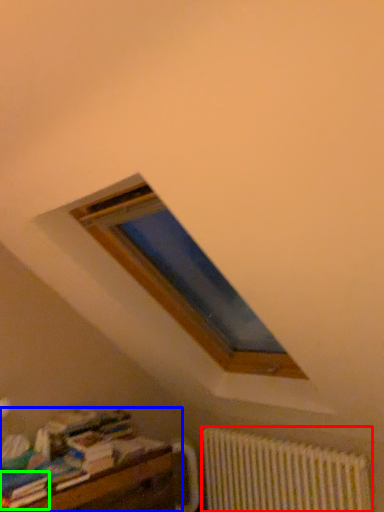
Question: Considering the real-world distances, which object is closest to radiator (highlighted by a red box)? furniture (highlighted by a blue box) or paperback book (highlighted by a green box).

Choices:
 (A) furniture
 (B) paperback book

Answer: (A)